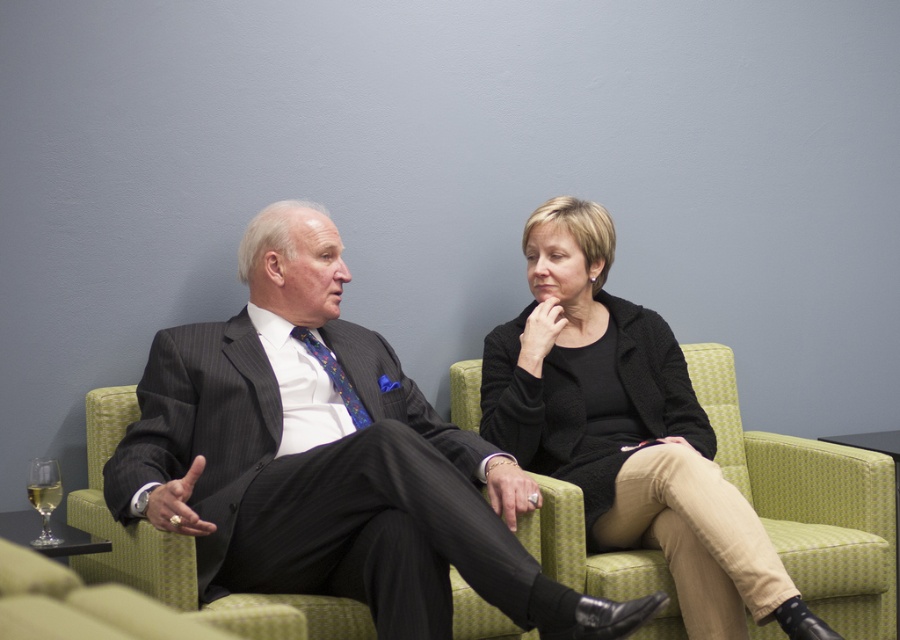
You are a photographer standing 6 feet away from the camera. You want to take a picture of the matte black suit at center. Can you reach the camera to adjust it without moving your position?

The distance between the matte black suit at center and the camera is 5.36 feet. Since you are 6 feet away from the camera, the total distance between you and the matte black suit at center would be 11.36 feet. Therefore, you cannot reach the camera to adjust it without moving closer.

Where is the matte black suit at center located in the image?

The matte black suit at center is located at point (330, 460).